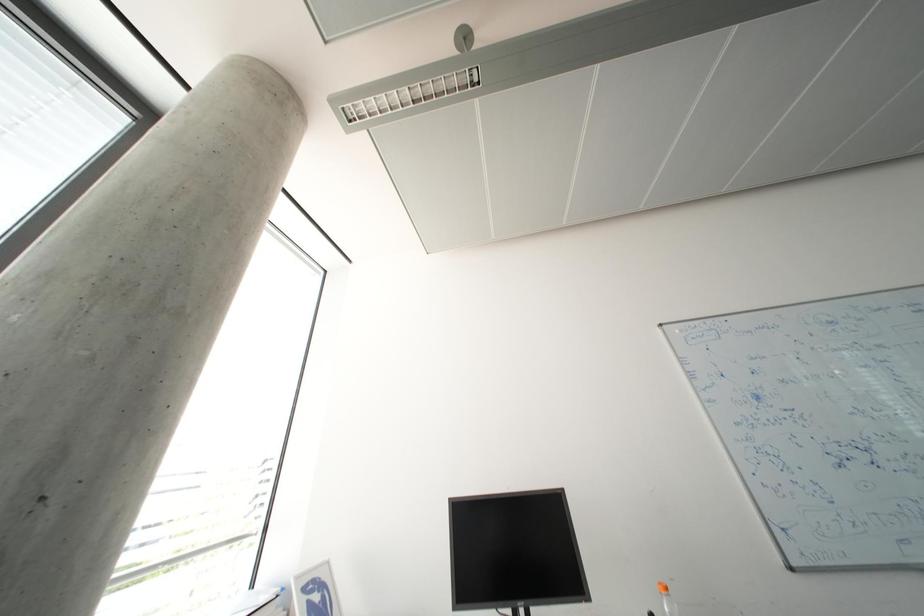
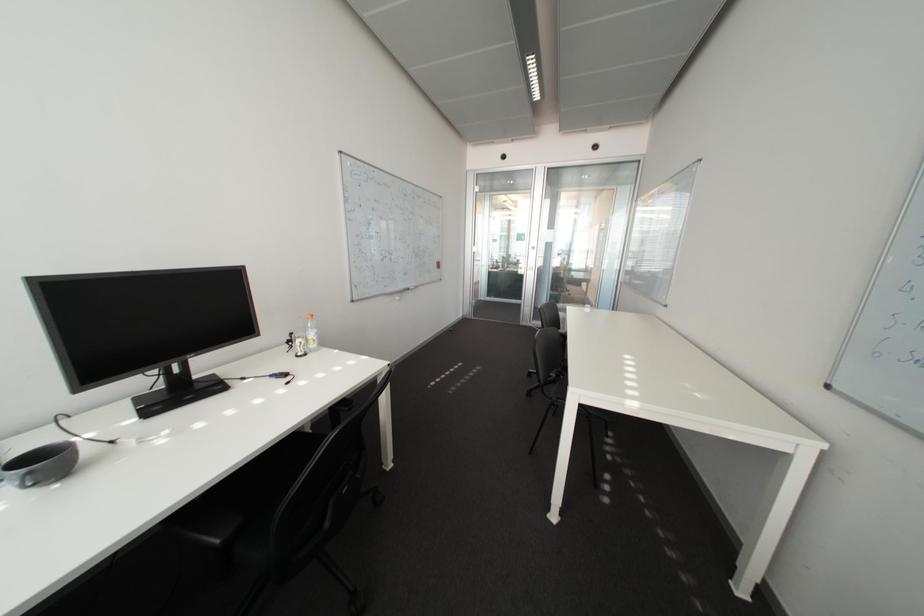
Question: The first image is from the beginning of the video and the second image is from the end. How did the camera likely rotate when shooting the video?

Choices:
 (A) Left
 (B) Right
 (C) Up
 (D) Down

Answer: (B)